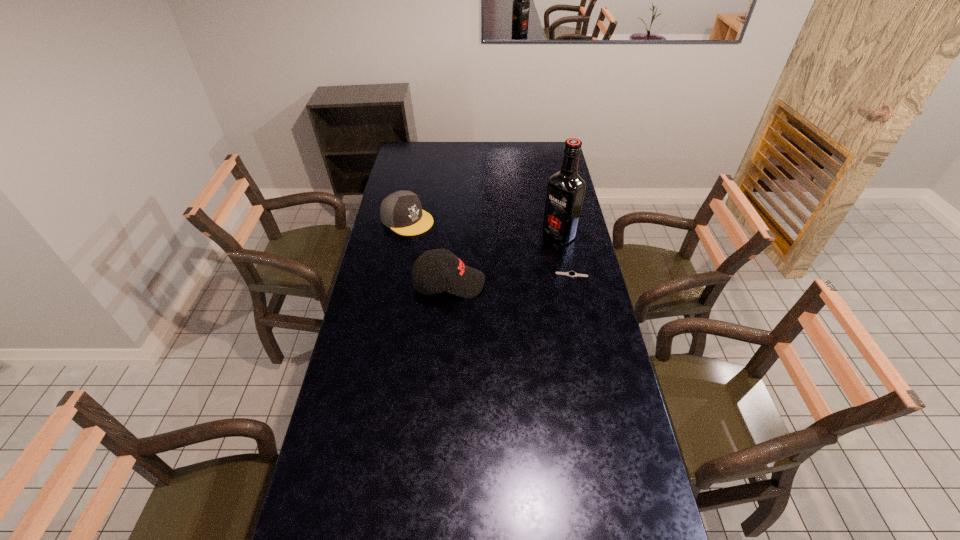
At what (x,y) coordinates should I click in order to perform the action: click on blank region between the baseball cap and the tallest object. Please return your answer as a coordinate pair (x, y). The image size is (960, 540). Looking at the image, I should click on (504, 259).

Identify which object is located as the nearest to the baseball cap. Please provide its 2D coordinates. Your answer should be formatted as a tuple, i.e. [(x, y)], where the tuple contains the x and y coordinates of a point satisfying the conditions above.

[(401, 211)]

Identify the location of object that can be found as the third closest to the watch. The height and width of the screenshot is (540, 960). (401, 211).

Locate an element on the screen. This screenshot has height=540, width=960. vacant region that satisfies the following two spatial constraints: 1. on the front side of the second tallest object; 2. on the front-facing side of the cap is located at coordinates (395, 283).

Identify the location of free space that satisfies the following two spatial constraints: 1. on the front side of the cap; 2. on the front-facing side of the baseball cap. The image size is (960, 540). (395, 283).